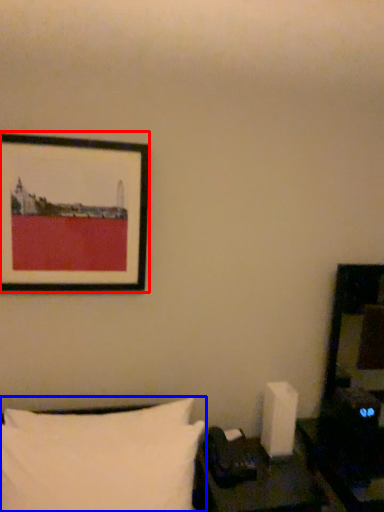
Question: Which object appears closest to the camera in this image, picture frame (highlighted by a red box) or pillow (highlighted by a blue box)?

Choices:
 (A) picture frame
 (B) pillow

Answer: (B)